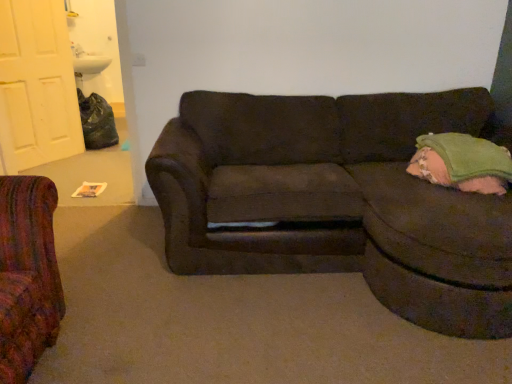
Question: Is dark brown fabric couch at center oriented away from white matte door at upper left?

Choices:
 (A) yes
 (B) no

Answer: (B)

Question: Can you confirm if dark brown fabric couch at center is wider than white matte door at upper left?

Choices:
 (A) yes
 (B) no

Answer: (A)

Question: Is dark brown fabric couch at center thinner than white matte door at upper left?

Choices:
 (A) no
 (B) yes

Answer: (A)

Question: From a real-world perspective, is dark brown fabric couch at center over white matte door at upper left?

Choices:
 (A) no
 (B) yes

Answer: (A)

Question: From the image's perspective, is dark brown fabric couch at center below white matte door at upper left?

Choices:
 (A) yes
 (B) no

Answer: (A)

Question: Relative to green fabric pillow at right, is white matte door at upper left in front or behind?

Choices:
 (A) front
 (B) behind

Answer: (B)

Question: From a real-world perspective, is white matte door at upper left positioned above or below green fabric pillow at right?

Choices:
 (A) below
 (B) above

Answer: (B)

Question: Considering the positions of white matte door at upper left and green fabric pillow at right in the image, is white matte door at upper left wider or thinner than green fabric pillow at right?

Choices:
 (A) wide
 (B) thin

Answer: (B)

Question: Is white matte door at upper left taller or shorter than green fabric pillow at right?

Choices:
 (A) tall
 (B) short

Answer: (A)

Question: From the image's perspective, is green fabric pillow at right positioned above or below white matte door at upper left?

Choices:
 (A) above
 (B) below

Answer: (B)

Question: Looking at their shapes, would you say green fabric pillow at right is wider or thinner than white matte door at upper left?

Choices:
 (A) wide
 (B) thin

Answer: (A)

Question: In terms of height, does green fabric pillow at right look taller or shorter compared to white matte door at upper left?

Choices:
 (A) short
 (B) tall

Answer: (A)

Question: Is green fabric pillow at right inside the boundaries of white matte door at upper left, or outside?

Choices:
 (A) outside
 (B) inside

Answer: (A)

Question: From a real-world perspective, is green fabric pillow at right positioned above or below dark brown fabric couch at center?

Choices:
 (A) below
 (B) above

Answer: (B)

Question: Is point (492, 150) positioned closer to the camera than point (474, 286)?

Choices:
 (A) farther
 (B) closer

Answer: (A)